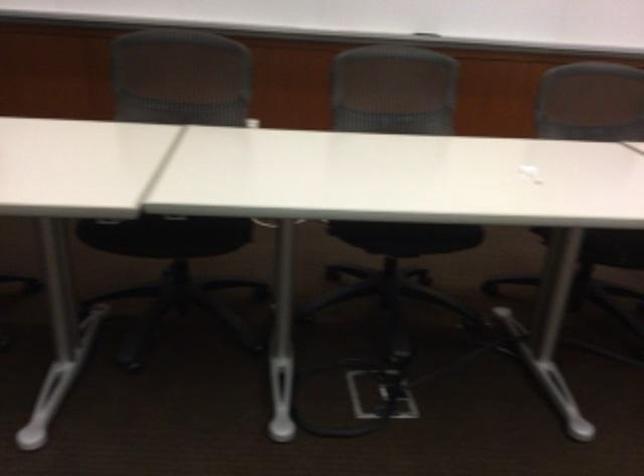
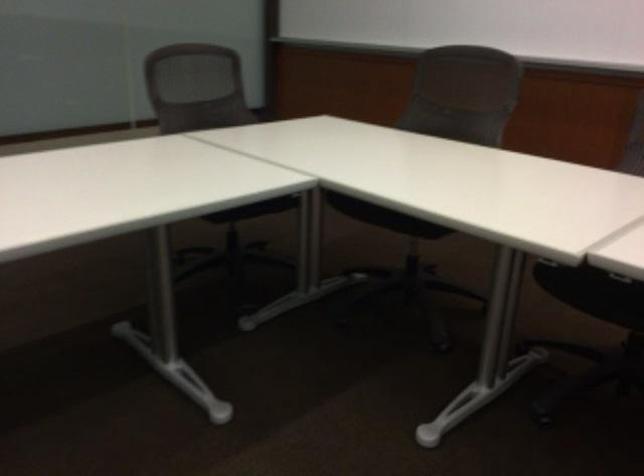
Question: How did the camera likely rotate?

Choices:
 (A) Left
 (B) Right
 (C) Up
 (D) Down

Answer: (A)